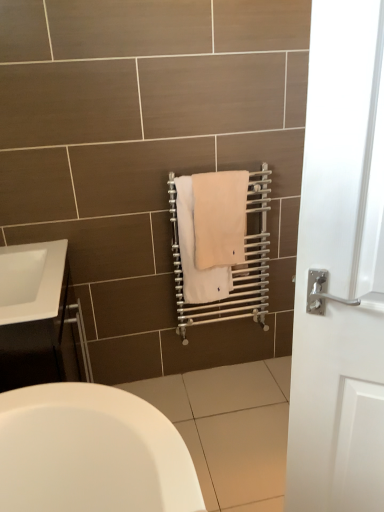
Question: Is white glossy cabinet at left surrounded by beige cotton towel at center, placed as the 1th bath towel when sorted from left to right?

Choices:
 (A) yes
 (B) no

Answer: (B)

Question: Is beige cotton towel at center, the 2th bath towel viewed from the right, positioned behind white glossy cabinet at left?

Choices:
 (A) yes
 (B) no

Answer: (A)

Question: Is beige cotton towel at center, placed as the 1th bath towel when sorted from left to right, wider than white glossy cabinet at left?

Choices:
 (A) yes
 (B) no

Answer: (B)

Question: From a real-world perspective, is beige cotton towel at center, the 2th bath towel viewed from the right, below white glossy cabinet at left?

Choices:
 (A) yes
 (B) no

Answer: (B)

Question: Would you say beige cotton towel at center, the 2th bath towel viewed from the right, is inside or outside white glossy cabinet at left?

Choices:
 (A) outside
 (B) inside

Answer: (A)

Question: From the image's perspective, is beige cotton towel at center, the 2th bath towel viewed from the right, located above or below white glossy cabinet at left?

Choices:
 (A) above
 (B) below

Answer: (A)

Question: Based on their positions, is beige cotton towel at center, the 2th bath towel viewed from the right, located to the left or right of white glossy cabinet at left?

Choices:
 (A) right
 (B) left

Answer: (A)

Question: From their relative heights in the image, would you say beige cotton towel at center, the 2th bath towel viewed from the right, is taller or shorter than white glossy cabinet at left?

Choices:
 (A) tall
 (B) short

Answer: (B)

Question: Is point (206, 279) closer or farther from the camera than point (223, 244)?

Choices:
 (A) farther
 (B) closer

Answer: (A)

Question: Considering their positions, is beige cotton towel at center, placed as the 1th bath towel when sorted from left to right, located in front of or behind beige cotton towel at center, the 2th bath towel viewed from the left?

Choices:
 (A) front
 (B) behind

Answer: (B)

Question: Looking at the image, does beige cotton towel at center, placed as the 1th bath towel when sorted from left to right, seem bigger or smaller compared to beige cotton towel at center, the 2th bath towel viewed from the left?

Choices:
 (A) small
 (B) big

Answer: (B)

Question: From a real-world perspective, is beige cotton towel at center, the 2th bath towel viewed from the right, positioned above or below beige cotton towel at center, the 2th bath towel viewed from the left?

Choices:
 (A) above
 (B) below

Answer: (B)

Question: Would you say white glossy cabinet at left is to the left or to the right of beige cotton towel at center, placed as the 1th bath towel when sorted from left to right, in the picture?

Choices:
 (A) right
 (B) left

Answer: (B)

Question: From a real-world perspective, is white glossy cabinet at left above or below beige cotton towel at center, the 2th bath towel viewed from the right?

Choices:
 (A) above
 (B) below

Answer: (B)